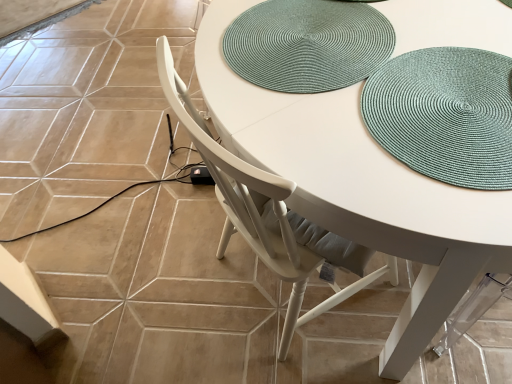
You are a GUI agent. You are given a task and a screenshot of the screen. Output one action in this format:
    pyautogui.click(x=<x>, y=<y>)
    Task: Click on the empty space that is ontop of teal woven placemat at upper center
    Image resolution: width=512 pixels, height=384 pixels.
    Given the screenshot: What is the action you would take?
    pyautogui.click(x=303, y=43)